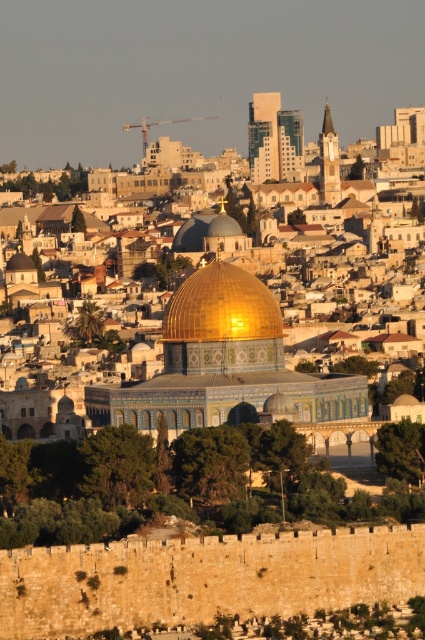
Question: Is golden reflective dome at center closer to camera compared to goldshinydome at center?

Choices:
 (A) no
 (B) yes

Answer: (B)

Question: Which of the following is the farthest from the observer?

Choices:
 (A) (223, 225)
 (B) (235, 275)

Answer: (A)

Question: Among these objects, which one is farthest from the camera?

Choices:
 (A) goldshinydome at center
 (B) golden reflective dome at center

Answer: (A)

Question: Considering the relative positions of golden reflective dome at center and goldshinydome at center in the image provided, where is golden reflective dome at center located with respect to goldshinydome at center?

Choices:
 (A) right
 (B) left

Answer: (A)

Question: Which point is farther from the camera taking this photo?

Choices:
 (A) (229, 250)
 (B) (258, 304)

Answer: (A)

Question: Is golden reflective dome at center above goldshinydome at center?

Choices:
 (A) yes
 (B) no

Answer: (B)